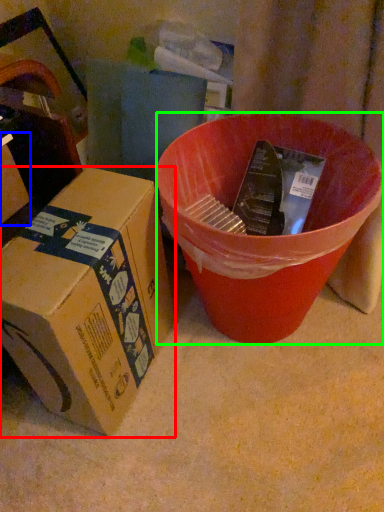
Question: Estimate the real-world distances between objects in this image. Which object is farther from box (highlighted by a red box), box (highlighted by a blue box) or bucket (highlighted by a green box)?

Choices:
 (A) box
 (B) bucket

Answer: (A)